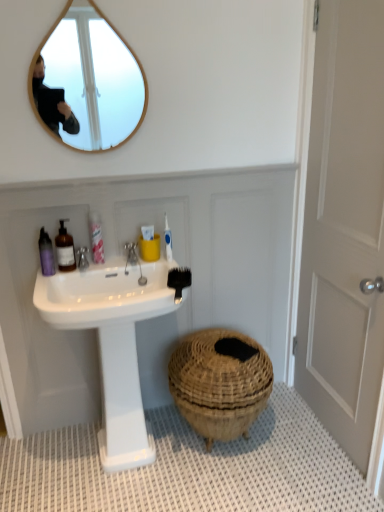
At what (x,y) coordinates should I click in order to perform the action: click on vacant space underneath white glossy sink at center (from a real-world perspective). Please return your answer as a coordinate pair (x, y). Image resolution: width=384 pixels, height=512 pixels. Looking at the image, I should click on (123, 470).